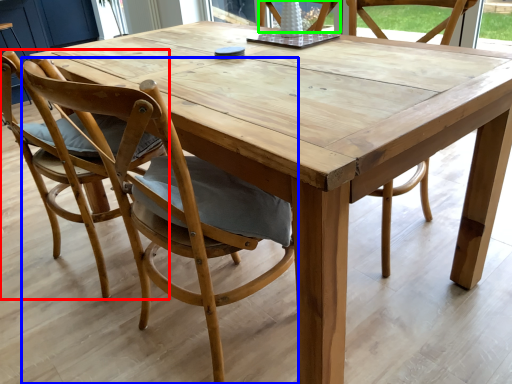
Question: Which object is positioned closest to chair (highlighted by a red box)? Select from chair (highlighted by a blue box) and chair (highlighted by a green box).

Choices:
 (A) chair
 (B) chair

Answer: (A)